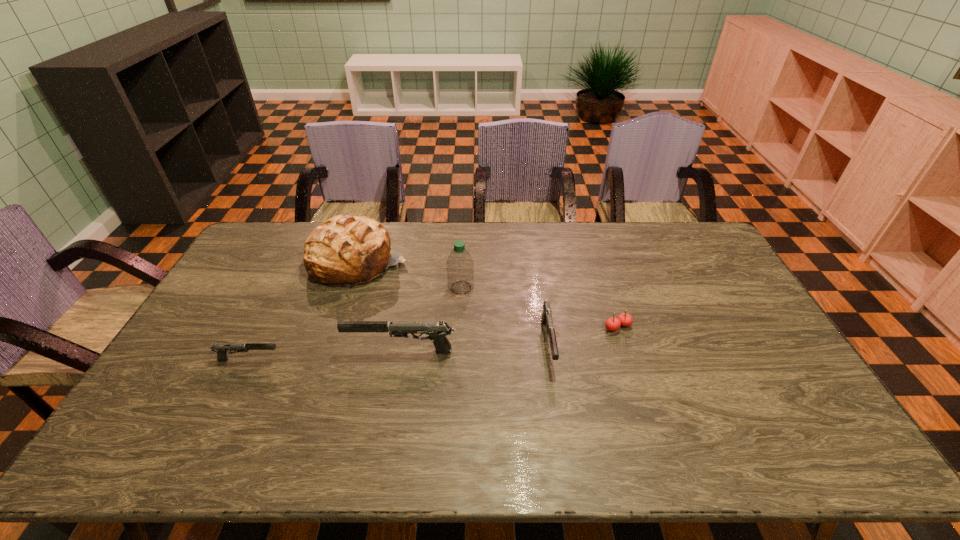
Identify the location of free space between the water bottle and the tallest gun. The image size is (960, 540). (431, 320).

Locate an element on the screen. The image size is (960, 540). vacant space in between the leftmost gun and the rightmost gun is located at coordinates (398, 352).

Find the location of a particular element. The width and height of the screenshot is (960, 540). object that ranks as the second closest to the shortest gun is located at coordinates (344, 251).

This screenshot has width=960, height=540. I want to click on object that is the second closest to the fourth tallest object, so click(460, 267).

Select which gun is the third closest to the bread. Please provide its 2D coordinates. Your answer should be formatted as a tuple, i.e. [(x, y)], where the tuple contains the x and y coordinates of a point satisfying the conditions above.

[(546, 317)]

Locate which gun is the third closest to the bread. Please provide its 2D coordinates. Your answer should be formatted as a tuple, i.e. [(x, y)], where the tuple contains the x and y coordinates of a point satisfying the conditions above.

[(546, 317)]

I want to click on blank space that satisfies the following two spatial constraints: 1. at the muzzle end of the rightmost gun; 2. at the muzzle end of the tallest gun, so click(x=549, y=352).

I want to click on vacant space that satisfies the following two spatial constraints: 1. at the muzzle end of the second object from right to left; 2. at the muzzle end of the leftmost gun, so click(x=551, y=360).